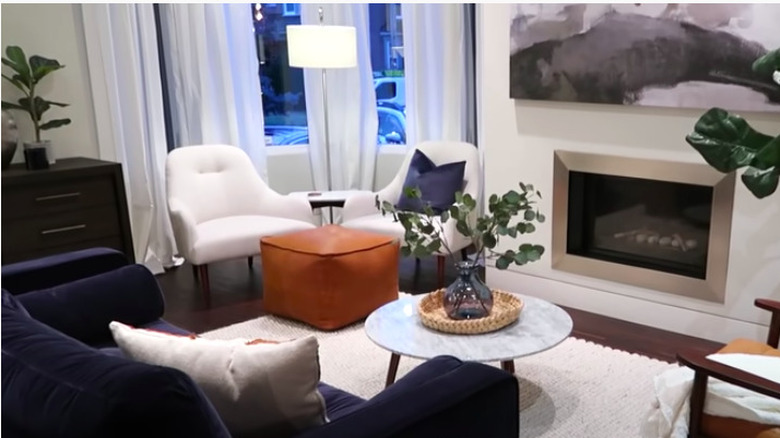
The height and width of the screenshot is (438, 780). What are the coordinates of `windows` in the screenshot? It's located at (275, 69), (390, 80).